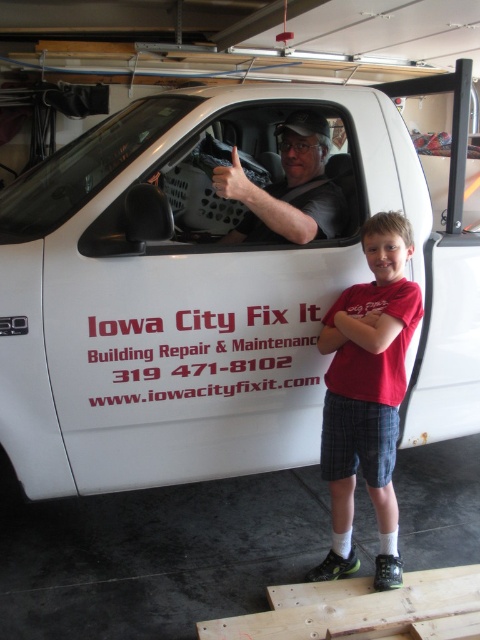
You are a delivery person who needs to hand a package to the driver inside the white pickup truck. The package is too large to fit through the window. Which object, the red cotton shirt at center or the transparent glass windshield at upper left, would you approach to deliver the package?

The red cotton shirt at center is much taller than the transparent glass windshield at upper left, so you should approach the red cotton shirt at center to deliver the package since it is taller and likely closer to the driver.

You are a customer looking to hire the repair service. You see the red cotton shirt at center and the transparent glass windshield at upper left in the image. Which object would you interact with to contact the service provider?

The transparent glass windshield at upper left cannot be interacted with to contact the service provider. Instead, you should look at the information on the truck side, such as the phone number or website, which are not part of the listed objects.